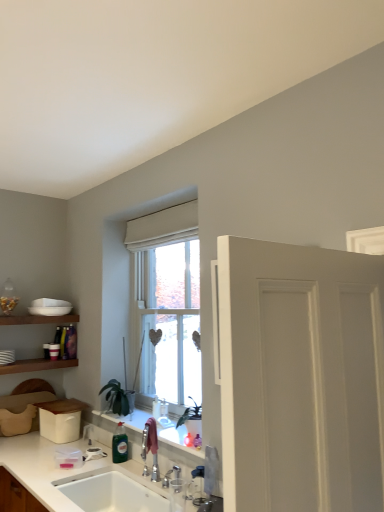
Question: Does green glass bottle at sink have a greater width compared to white ceramic sink at lower left?

Choices:
 (A) yes
 (B) no

Answer: (B)

Question: Is white ceramic sink at lower left inside green glass bottle at sink?

Choices:
 (A) yes
 (B) no

Answer: (B)

Question: From a real-world perspective, is green glass bottle at sink under white ceramic sink at lower left?

Choices:
 (A) no
 (B) yes

Answer: (A)

Question: Is green glass bottle at sink positioned beyond the bounds of white ceramic sink at lower left?

Choices:
 (A) yes
 (B) no

Answer: (A)

Question: Is green glass bottle at sink taller than white ceramic sink at lower left?

Choices:
 (A) yes
 (B) no

Answer: (A)

Question: From a real-world perspective, is white ceramic sink at lower left positioned above or below green glass bottle at sink?

Choices:
 (A) below
 (B) above

Answer: (A)

Question: In terms of height, does white ceramic sink at lower left look taller or shorter compared to green glass bottle at sink?

Choices:
 (A) short
 (B) tall

Answer: (A)

Question: Relative to green glass bottle at sink, is white ceramic sink at lower left in front or behind?

Choices:
 (A) front
 (B) behind

Answer: (A)

Question: From the image's perspective, is white ceramic sink at lower left located above or below green glass bottle at sink?

Choices:
 (A) below
 (B) above

Answer: (A)

Question: Visually, is white glossy countertop at lower center positioned to the left or to the right of white ceramic sink at lower left?

Choices:
 (A) left
 (B) right

Answer: (A)

Question: Is white glossy countertop at lower center taller or shorter than white ceramic sink at lower left?

Choices:
 (A) short
 (B) tall

Answer: (A)

Question: Looking at their shapes, would you say white glossy countertop at lower center is wider or thinner than white ceramic sink at lower left?

Choices:
 (A) wide
 (B) thin

Answer: (A)

Question: Is white glossy countertop at lower center inside the boundaries of white ceramic sink at lower left, or outside?

Choices:
 (A) inside
 (B) outside

Answer: (B)

Question: Does point (122, 441) appear closer or farther from the camera than point (110, 380)?

Choices:
 (A) farther
 (B) closer

Answer: (B)

Question: Based on their sizes in the image, would you say green glass bottle at sink is bigger or smaller than green matte plant at center?

Choices:
 (A) big
 (B) small

Answer: (B)